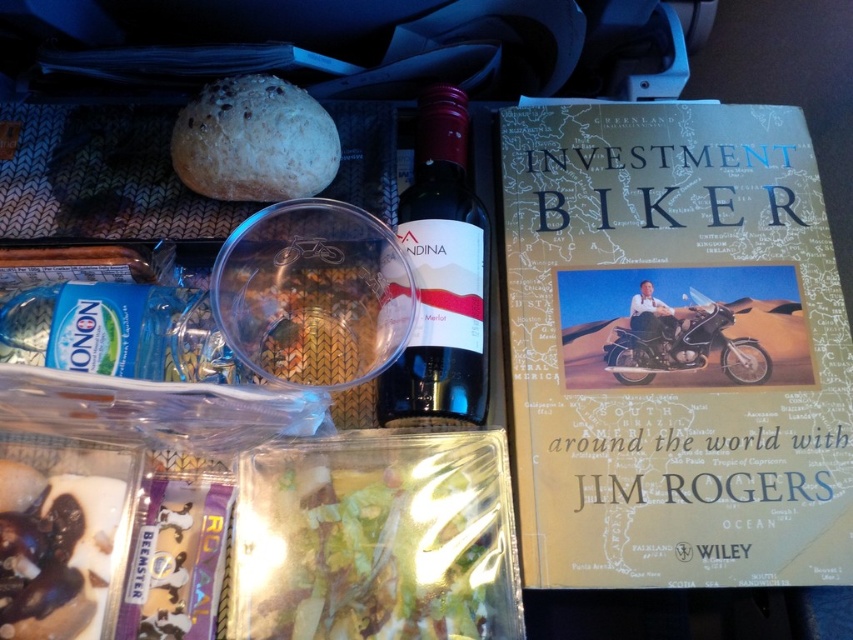
Does matte glass wine bottle at center appear on the right side of chocolate-coated nuts at lower left?

Yes, matte glass wine bottle at center is to the right of chocolate-coated nuts at lower left.

Does matte glass wine bottle at center have a greater height compared to chocolate-coated nuts at lower left?

Yes.

Which is behind, point (387, 419) or point (48, 545)?

The point (387, 419) is more distant.

Find the location of a particular element. matte glass wine bottle at center is located at coordinates (440, 276).

From the picture: Is brown crumbly bread at upper left smaller than metallic silver motorcycle at center?

No, brown crumbly bread at upper left is not smaller than metallic silver motorcycle at center.

The width and height of the screenshot is (853, 640). What do you see at coordinates (254, 141) in the screenshot?
I see `brown crumbly bread at upper left` at bounding box center [254, 141].

Between point (277, 160) and point (706, 300), which one is positioned in front?

Positioned in front is point (277, 160).

Identify the location of brown crumbly bread at upper left. (254, 141).

Who is taller, translucent plastic salad at center or brown crumbly bread at upper left?

translucent plastic salad at center is taller.

Between translucent plastic salad at center and brown crumbly bread at upper left, which one is positioned lower?

translucent plastic salad at center is lower down.

Is point (486, 611) in front of point (222, 152)?

That is True.

Identify the location of translucent plastic salad at center. This screenshot has height=640, width=853. (373, 545).